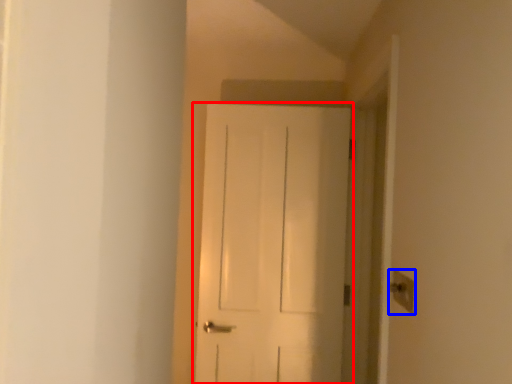
Question: Which object is closer to the camera taking this photo, door (highlighted by a red box) or light switch (highlighted by a blue box)?

Choices:
 (A) door
 (B) light switch

Answer: (B)